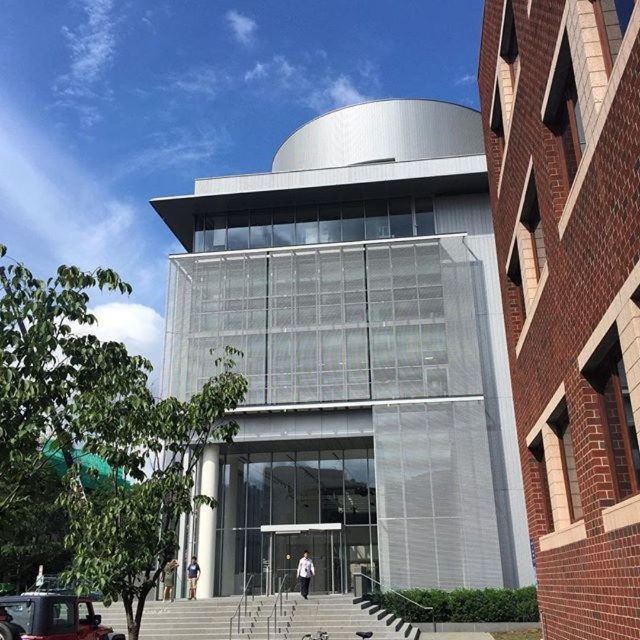
You are a delivery person trying to park a matte black car at lower left that is 1.8 meters tall. The parking space near the clear glass door at center has a height restriction of 1.7 meters. Will the car fit?

The matte black car at lower left has a greater height compared to clear glass door at center. Since the car is taller than the 1.7 meter restriction, it will not fit in the parking space.

You are standing in front of the modern architectural structure. You see the gray concrete stairs at center and the white fabric shirt at center. Which object is closer to you?

The gray concrete stairs at center is closer to you because it is in front of the white fabric shirt at center.

You are standing at the camera position and want to move to the entrance of the building. The entrance is located at the base of the glass structure. There is a matte black car at lower left in your way. Can you walk around the car to reach the entrance without going near the car?

The matte black car at lower left is 8.92 meters away from the camera. Since the car is positioned at the lower left, you can walk around it either to the right side of the car towards the glass structure entrance, avoiding proximity to the car.